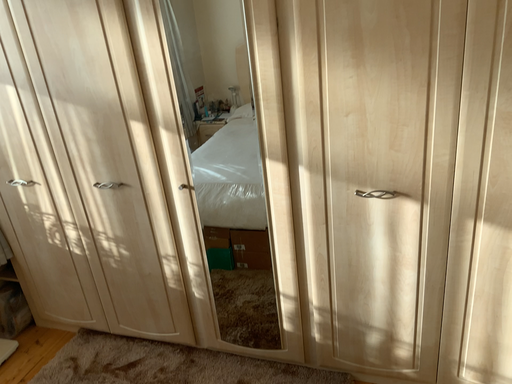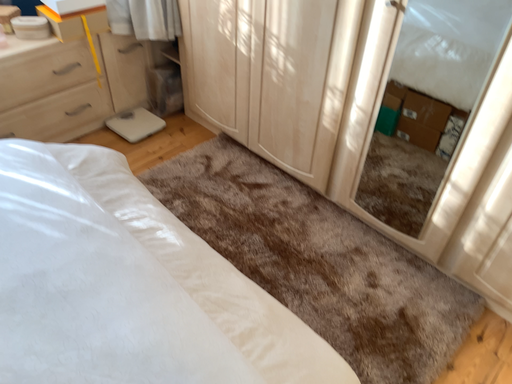
Question: How did the camera likely rotate when shooting the video?

Choices:
 (A) rotated downward
 (B) rotated upward

Answer: (A)